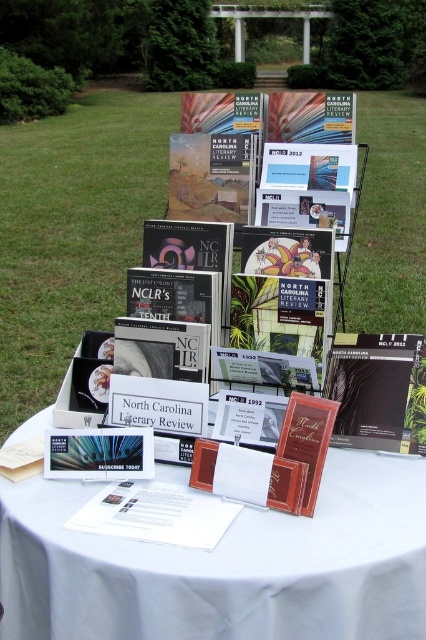
Measure the distance from matte black book at center to matte red card at center.

matte black book at center is 11.12 inches from matte red card at center.

The height and width of the screenshot is (640, 426). Describe the element at coordinates (379, 392) in the screenshot. I see `matte black book at center` at that location.

This screenshot has width=426, height=640. Find the location of `matte black book at center`. matte black book at center is located at coordinates (379, 392).

Between white paper at center and matte red card at center, which one is positioned higher?

matte red card at center is above.

Is white paper at center bigger than matte red card at center?

Indeed, white paper at center has a larger size compared to matte red card at center.

Image resolution: width=426 pixels, height=640 pixels. I want to click on white paper at center, so click(x=157, y=515).

Does white cloth at center appear over matte red card at center?

No, white cloth at center is not above matte red card at center.

What do you see at coordinates (224, 566) in the screenshot?
I see `white cloth at center` at bounding box center [224, 566].

What are the coordinates of `white cloth at center` in the screenshot? It's located at (224, 566).